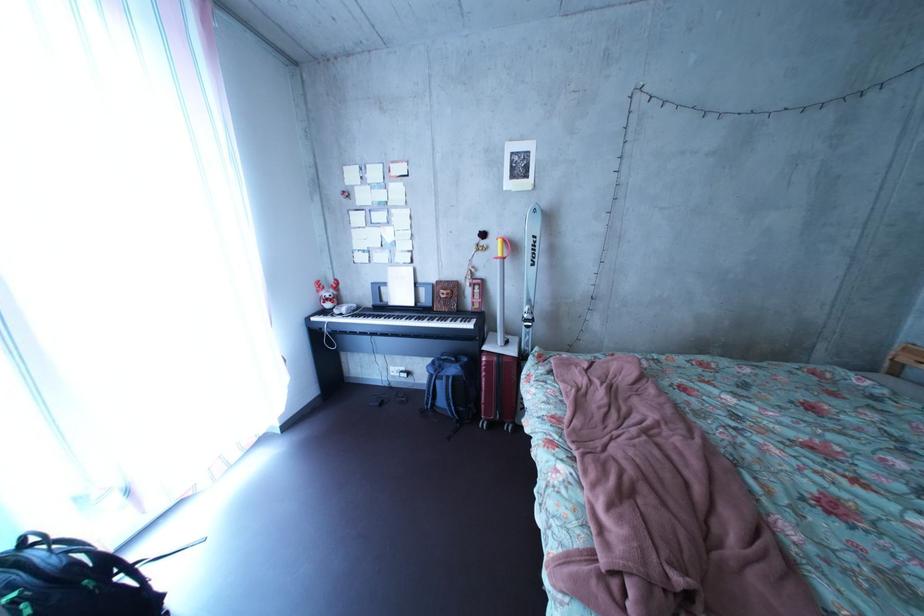
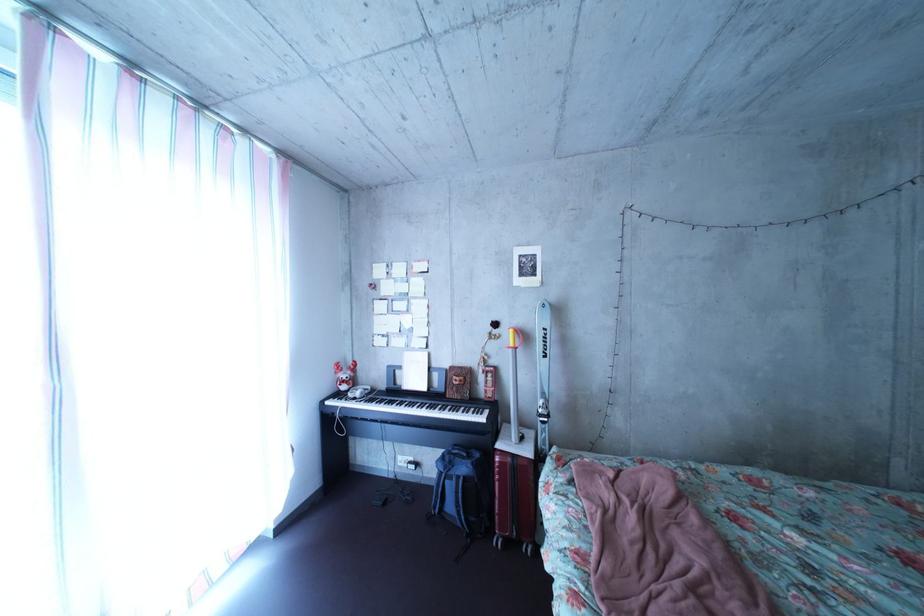
Find the pixel in the second image that matches point 343,314 in the first image.

(358, 395)